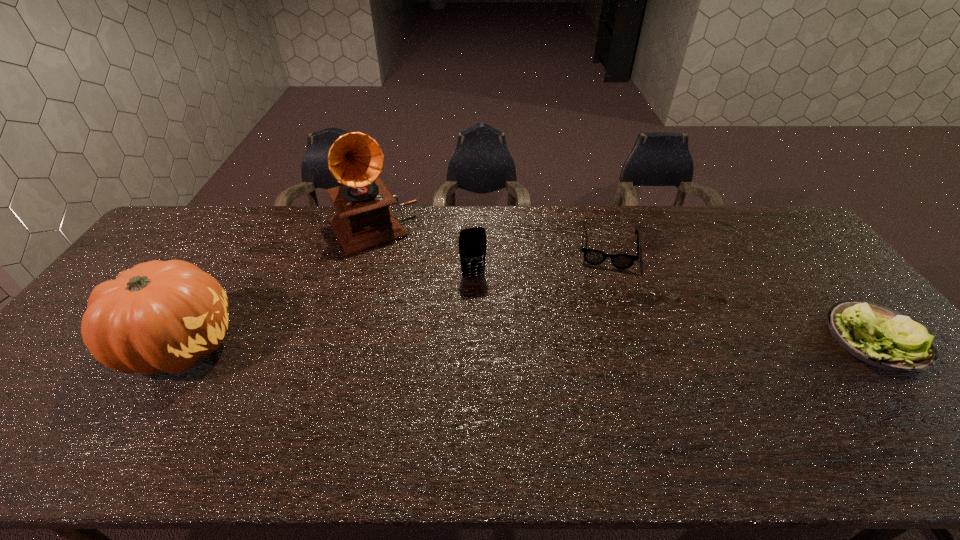
Locate an element on the screen. The image size is (960, 540). the leftmost object is located at coordinates (157, 316).

Identify the location of the second tallest object. The height and width of the screenshot is (540, 960). (157, 316).

Image resolution: width=960 pixels, height=540 pixels. Identify the location of the rightmost object. (877, 335).

Find the location of a particular element. lettuce is located at coordinates (877, 335).

Find the location of a particular element. the third object from left to right is located at coordinates (472, 242).

Image resolution: width=960 pixels, height=540 pixels. In order to click on cellular telephone in this screenshot , I will do `click(472, 242)`.

Identify the location of the shortest object. This screenshot has width=960, height=540. (594, 257).

At what (x,y) coordinates should I click in order to perform the action: click on spectacles. Please return your answer as a coordinate pair (x, y). Looking at the image, I should click on (594, 257).

You are a GUI agent. You are given a task and a screenshot of the screen. Output one action in this format:
    pyautogui.click(x=<x>, y=<y>)
    Task: Click on the second object from left to right
    Image resolution: width=960 pixels, height=540 pixels.
    Given the screenshot: What is the action you would take?
    pyautogui.click(x=364, y=221)

At what (x,y) coordinates should I click in order to perform the action: click on phonograph record. Please return your answer as a coordinate pair (x, y). Looking at the image, I should click on (364, 221).